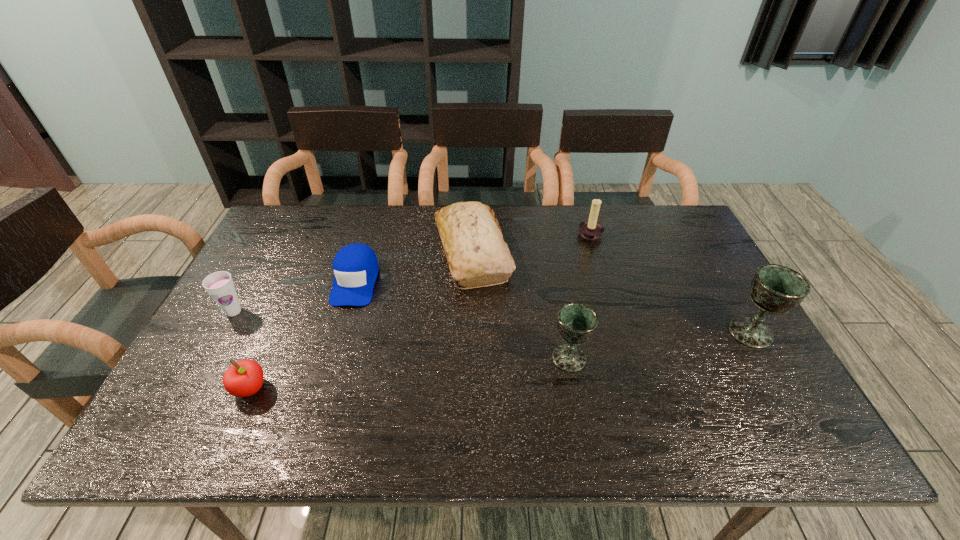
At what (x,y) coordinates should I click in order to perform the action: click on chalice present at the near edge. Please return your answer as a coordinate pair (x, y). Looking at the image, I should click on (577, 322).

Locate an element on the screen. The width and height of the screenshot is (960, 540). apple located at the near edge is located at coordinates (244, 378).

Locate an element on the screen. cup at the left edge is located at coordinates (220, 286).

The height and width of the screenshot is (540, 960). In order to click on apple located at the left edge in this screenshot , I will do `click(244, 378)`.

Identify the location of object at the right edge. This screenshot has width=960, height=540. (775, 289).

You are a GUI agent. You are given a task and a screenshot of the screen. Output one action in this format:
    pyautogui.click(x=<x>, y=<y>)
    Task: Click on the object that is at the near left corner
    The image size is (960, 540).
    Given the screenshot: What is the action you would take?
    pyautogui.click(x=244, y=378)

Where is `vacant space at the far edge`? vacant space at the far edge is located at coordinates (509, 248).

In the image, there is a desktop. Find the location of `free space at the near edge`. free space at the near edge is located at coordinates (320, 388).

In the image, there is a desktop. Where is `vacant space at the left edge`? The width and height of the screenshot is (960, 540). vacant space at the left edge is located at coordinates (230, 351).

This screenshot has width=960, height=540. Find the location of `vacant space at the right edge`. vacant space at the right edge is located at coordinates (710, 300).